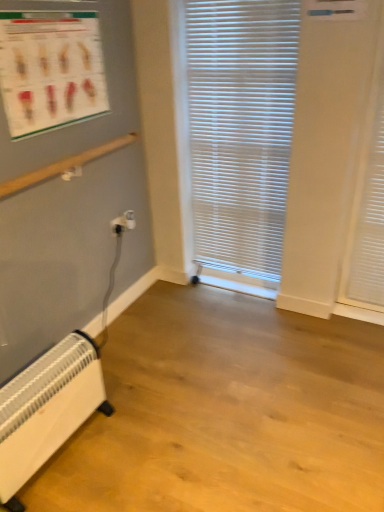
Where is `vacant area that is situated to the right of white plastic heater at lower left`? The image size is (384, 512). vacant area that is situated to the right of white plastic heater at lower left is located at coordinates (148, 444).